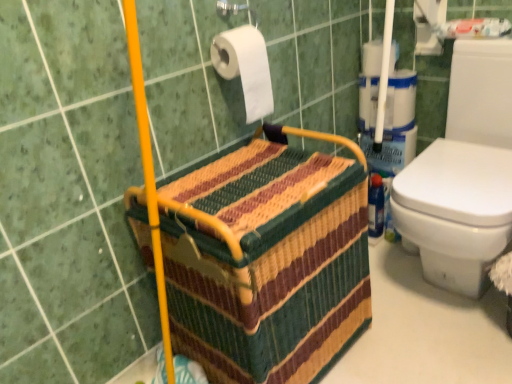
Question: From a real-world perspective, is white paper at upper center, positioned as the 1th toilet paper in back-to-front order, beneath multicolored woven basket at center?

Choices:
 (A) no
 (B) yes

Answer: (A)

Question: Can you confirm if white paper at upper center, which ranks as the 2th toilet paper in bottom-to-top order, is wider than multicolored woven basket at center?

Choices:
 (A) no
 (B) yes

Answer: (A)

Question: Considering the relative positions of white paper at upper center, which is counted as the 1th toilet paper, starting from the right, and multicolored woven basket at center in the image provided, is white paper at upper center, which is counted as the 1th toilet paper, starting from the right, behind multicolored woven basket at center?

Choices:
 (A) yes
 (B) no

Answer: (A)

Question: Can you confirm if white paper at upper center, positioned as the 1th toilet paper in back-to-front order, is bigger than multicolored woven basket at center?

Choices:
 (A) yes
 (B) no

Answer: (B)

Question: Is white paper at upper center, which is the 2th toilet paper from front to back, aimed at multicolored woven basket at center?

Choices:
 (A) no
 (B) yes

Answer: (B)

Question: Is white matte toilet paper at upper center, which is the 1th toilet paper from bottom to top, spatially inside multicolored woven basket at center, or outside of it?

Choices:
 (A) inside
 (B) outside

Answer: (B)

Question: Considering the positions of white matte toilet paper at upper center, which is the 1th toilet paper in left-to-right order, and multicolored woven basket at center in the image, is white matte toilet paper at upper center, which is the 1th toilet paper in left-to-right order, bigger or smaller than multicolored woven basket at center?

Choices:
 (A) big
 (B) small

Answer: (B)

Question: Is point (264, 105) closer or farther from the camera than point (276, 309)?

Choices:
 (A) farther
 (B) closer

Answer: (A)

Question: In terms of height, does white matte toilet paper at upper center, which is the 2th toilet paper from back to front, look taller or shorter compared to multicolored woven basket at center?

Choices:
 (A) short
 (B) tall

Answer: (A)

Question: Is white paper at upper center, which is counted as the 1th toilet paper, starting from the right, taller or shorter than white matte toilet paper at upper center, which is the 1th toilet paper from bottom to top?

Choices:
 (A) tall
 (B) short

Answer: (B)

Question: Is white paper at upper center, which is the 2th toilet paper from front to back, bigger or smaller than white matte toilet paper at upper center, which is the 1th toilet paper from bottom to top?

Choices:
 (A) small
 (B) big

Answer: (A)

Question: Does point (365, 44) appear closer or farther from the camera than point (224, 43)?

Choices:
 (A) closer
 (B) farther

Answer: (B)

Question: Looking at their shapes, would you say white paper at upper center, the first toilet paper positioned from the top, is wider or thinner than white matte toilet paper at upper center, which is the 2th toilet paper from back to front?

Choices:
 (A) thin
 (B) wide

Answer: (B)

Question: Is multicolored woven basket at center inside the boundaries of white matte toilet paper at upper center, which is the 1th toilet paper in front-to-back order, or outside?

Choices:
 (A) inside
 (B) outside

Answer: (B)

Question: In terms of width, does multicolored woven basket at center look wider or thinner when compared to white matte toilet paper at upper center, which is the 1th toilet paper in left-to-right order?

Choices:
 (A) thin
 (B) wide

Answer: (B)